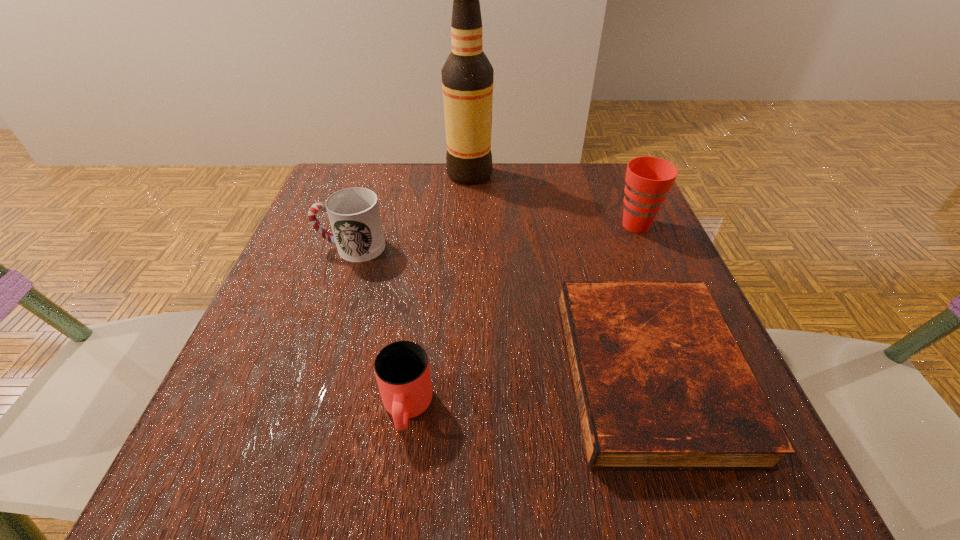
Where is `vacant space that satisfies the following two spatial constraints: 1. on the handle side of the leftmost object; 2. on the right side of the tallest cup`? The height and width of the screenshot is (540, 960). vacant space that satisfies the following two spatial constraints: 1. on the handle side of the leftmost object; 2. on the right side of the tallest cup is located at coordinates (359, 225).

What are the coordinates of `free location that satisfies the following two spatial constraints: 1. on the label of the tallest object; 2. on the back side of the tallest cup` in the screenshot? It's located at (468, 225).

Find the location of `free space in the image that satisfies the following two spatial constraints: 1. on the spine side of the Bible; 2. on the handle side of the nearest cup`. free space in the image that satisfies the following two spatial constraints: 1. on the spine side of the Bible; 2. on the handle side of the nearest cup is located at coordinates (662, 409).

Identify the location of vacant area in the image that satisfies the following two spatial constraints: 1. on the label of the tallest object; 2. on the handle side of the nearest cup. Image resolution: width=960 pixels, height=540 pixels. (462, 409).